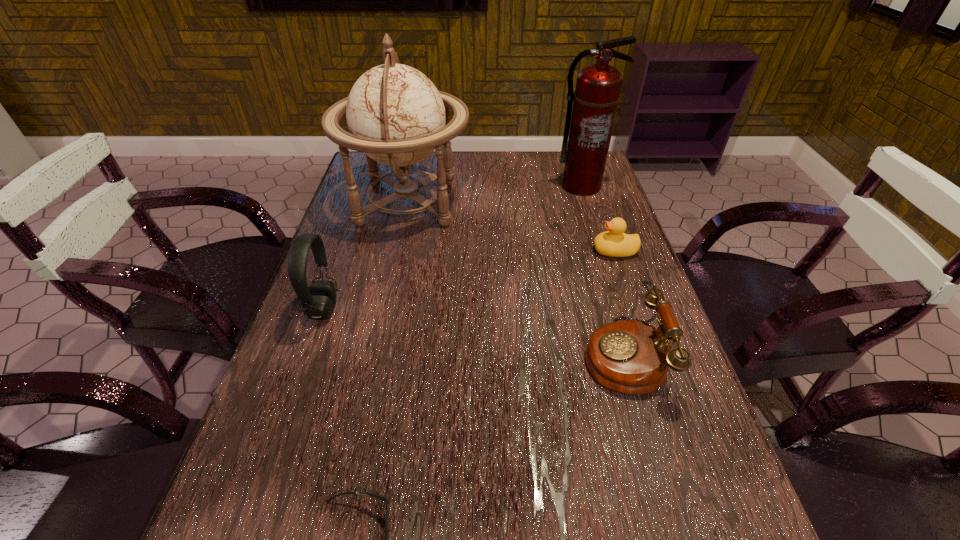
Identify the location of free space between the telephone and the globe. The image size is (960, 540). (515, 277).

Where is `free spot between the fire extinguisher and the third shortest object`? This screenshot has width=960, height=540. free spot between the fire extinguisher and the third shortest object is located at coordinates (601, 270).

Find the location of a particular element. This screenshot has width=960, height=540. free space between the fourth shortest object and the third farthest object is located at coordinates (469, 280).

This screenshot has width=960, height=540. Find the location of `unoccupied area between the fourth nearest object and the third shortest object`. unoccupied area between the fourth nearest object and the third shortest object is located at coordinates (618, 302).

Image resolution: width=960 pixels, height=540 pixels. Identify the location of object that ranks as the fifth closest to the third shortest object. (318, 299).

Choose which object is the nearest neighbor to the fifth tallest object. Please provide its 2D coordinates. Your answer should be formatted as a tuple, i.e. [(x, y)], where the tuple contains the x and y coordinates of a point satisfying the conditions above.

[(632, 357)]

Where is `free region that satisfies the following two spatial constraints: 1. on the nozzle side of the fire extinguisher; 2. on the front-facing side of the fourth shortest object`? The width and height of the screenshot is (960, 540). free region that satisfies the following two spatial constraints: 1. on the nozzle side of the fire extinguisher; 2. on the front-facing side of the fourth shortest object is located at coordinates (618, 309).

Find the location of `vacant space that satisfies the following two spatial constraints: 1. on the nozzle side of the fire extinguisher; 2. on the front-facing side of the third tallest object`. vacant space that satisfies the following two spatial constraints: 1. on the nozzle side of the fire extinguisher; 2. on the front-facing side of the third tallest object is located at coordinates (618, 309).